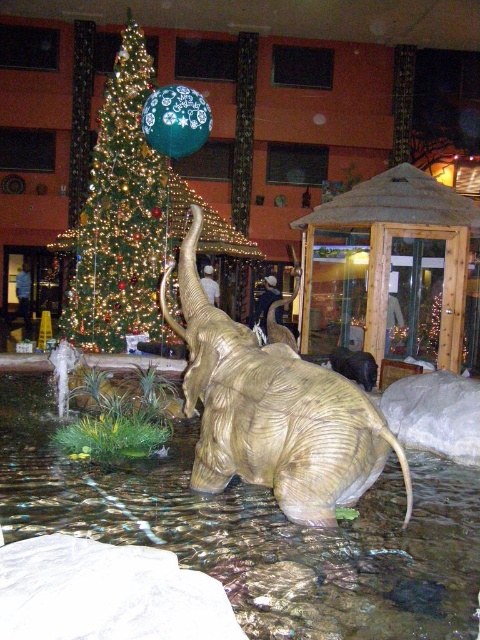
Is gold metallic elephant at center below green shiny christmas tree at left?

Correct, gold metallic elephant at center is located below green shiny christmas tree at left.

Who is lower down, gold metallic elephant at center or green shiny christmas tree at left?

gold metallic elephant at center

Is point (239, 358) closer to viewer compared to point (85, 348)?

Yes, point (239, 358) is closer to viewer.

Identify the location of gold metallic elephant at center. The width and height of the screenshot is (480, 640). (274, 412).